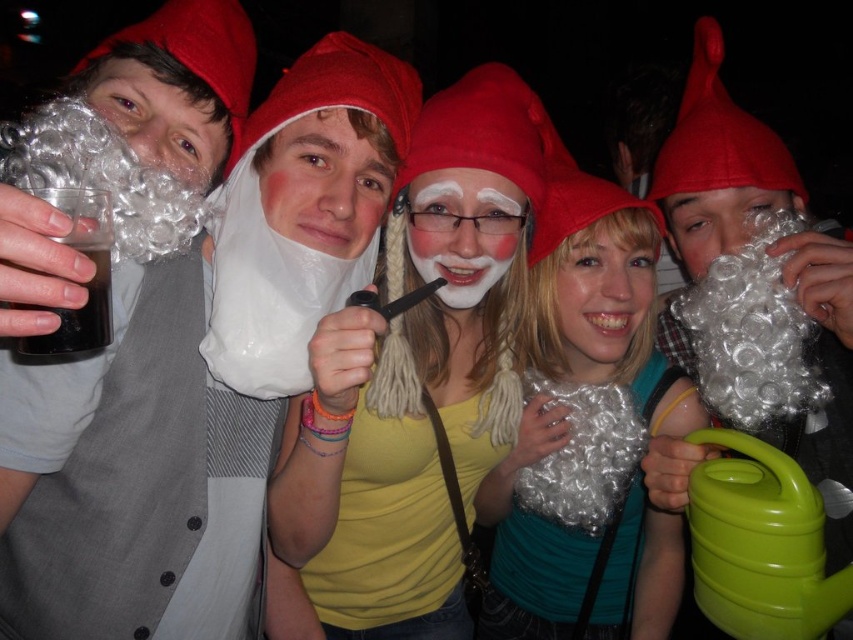
At what (x,y) coordinates should I click in order to perform the action: click on matte white beard at left. Please return your answer as a coordinate pair (x, y). This screenshot has height=640, width=853. Looking at the image, I should click on (198, 378).

Between point (68, 602) and point (292, 211), which one is positioned in front?

Point (68, 602) is in front.

Is point (28, 513) closer to camera compared to point (347, 209)?

Yes, point (28, 513) is closer to viewer.

The height and width of the screenshot is (640, 853). What are the coordinates of `matte white beard at left` in the screenshot? It's located at (198, 378).

Does white fluffy wig at center have a lesser height compared to white matte face paint at center?

In fact, white fluffy wig at center may be taller than white matte face paint at center.

Between white fluffy wig at center and white matte face paint at center, which one has more height?

white fluffy wig at center

Is point (795, 200) farther from viewer compared to point (424, 244)?

That is True.

Locate an element on the screen. The width and height of the screenshot is (853, 640). white fluffy wig at center is located at coordinates (717, 164).

Consider the image. Does matte white beard at center have a lesser height compared to white matte face paint at center?

Correct, matte white beard at center is not as tall as white matte face paint at center.

Measure the distance between matte white beard at center and white matte face paint at center.

A distance of 5.78 inches exists between matte white beard at center and white matte face paint at center.

Between point (347, 152) and point (490, 248), which one is positioned behind?

Point (490, 248)

The height and width of the screenshot is (640, 853). I want to click on matte white beard at center, so click(x=328, y=179).